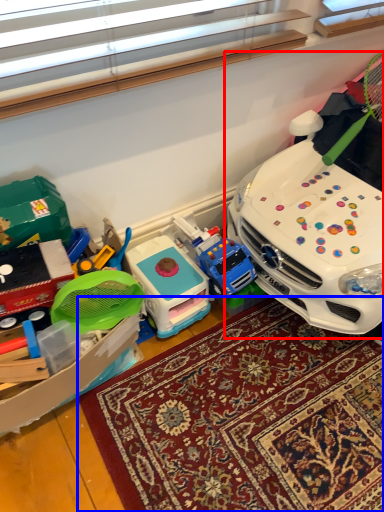
Question: Which of the following is the closest to the observer, toy (highlighted by a red box) or mat (highlighted by a blue box)?

Choices:
 (A) toy
 (B) mat

Answer: (A)